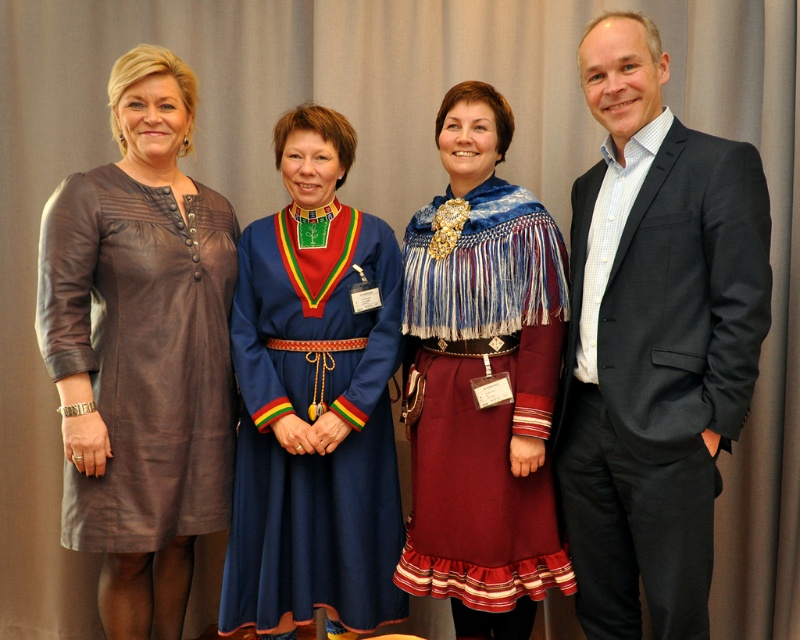
You are a photographer setting up for a group photo. The scene includes a woman in a brown dress on the far left, a woman in traditional Sami attire, and a man in a dark gray suit at the right. Where should you position your camera to ensure all subjects are in frame? Consider the positions of the dark gray suit at right and the other individuals.

To ensure all subjects are in frame, position the camera centrally facing the group, as the dark gray suit at right is located at point (654, 340), which is within the central viewing area. This placement will capture everyone from the woman in the brown dress on the far left to the man in the dark gray suit at the right.